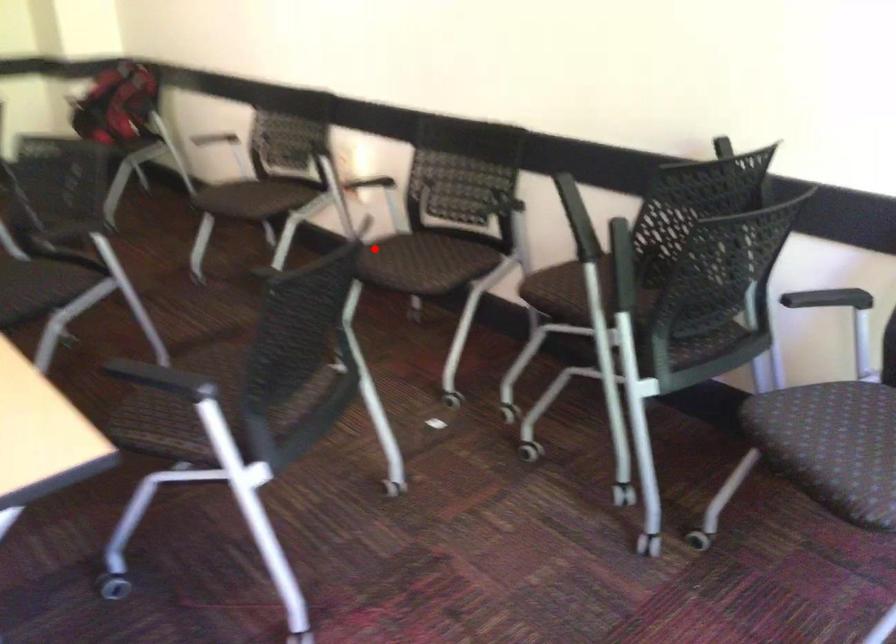
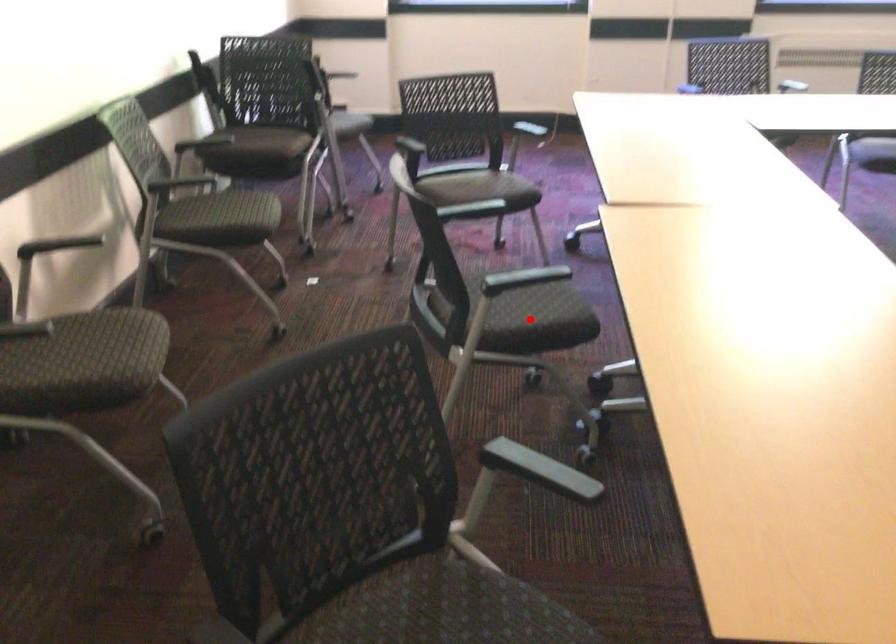
I am providing you with two images of the same scene from different viewpoints. A red point is marked on the first image and another point is marked on the second image. Are the points marked in image1 and image2 representing the same 3D position?

No